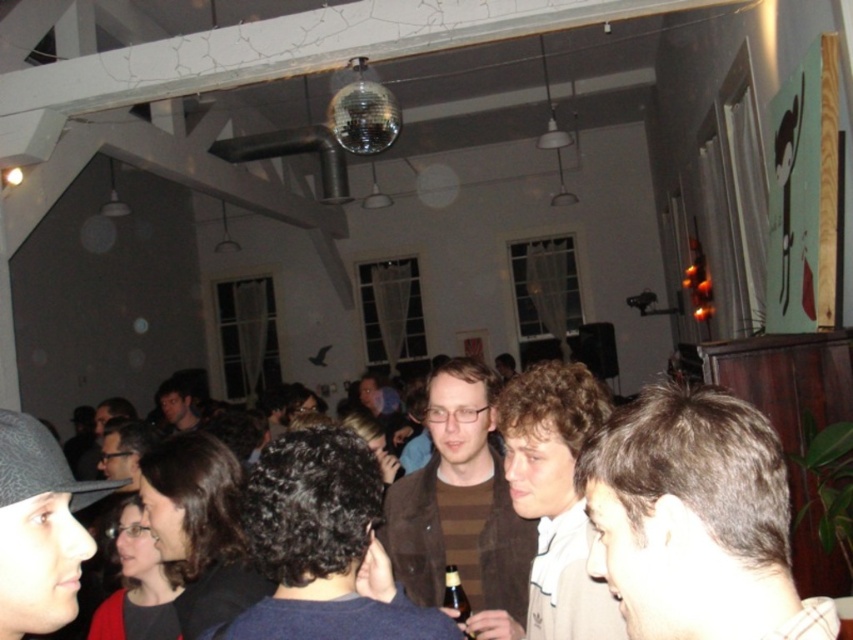
Is point (581, 508) farther from viewer compared to point (187, 417)?

No.

This screenshot has height=640, width=853. Identify the location of brown textured sweater at center. (556, 497).

Which of these two, brown textured sweater at center or brown glass bottle at center, stands shorter?

brown glass bottle at center is shorter.

The image size is (853, 640). Describe the element at coordinates (556, 497) in the screenshot. I see `brown textured sweater at center` at that location.

Where is `brown textured sweater at center`? This screenshot has width=853, height=640. brown textured sweater at center is located at coordinates (556, 497).

Between brown wool sweater at center and brown textured sweater at center, which one appears on the right side from the viewer's perspective?

brown textured sweater at center is more to the right.

Consider the image. Does brown wool sweater at center have a smaller size compared to brown textured sweater at center?

Yes, brown wool sweater at center is smaller than brown textured sweater at center.

Is point (322, 456) positioned after point (583, 618)?

No.

What are the coordinates of `brown wool sweater at center` in the screenshot? It's located at (323, 547).